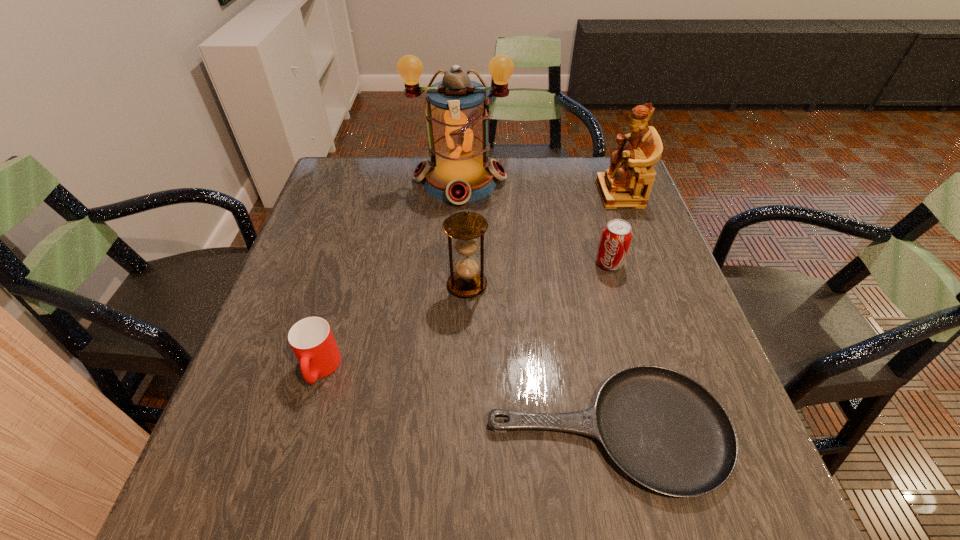
This screenshot has height=540, width=960. I want to click on free space between the hourglass and the fifth shortest object, so click(x=543, y=239).

Image resolution: width=960 pixels, height=540 pixels. I want to click on vacant space that's between the frying pan and the soda, so click(x=609, y=347).

Locate an element on the screen. Image resolution: width=960 pixels, height=540 pixels. vacant space that is in between the shortest object and the second shortest object is located at coordinates (464, 400).

This screenshot has width=960, height=540. What are the coordinates of `vacant area between the soda and the second shortest object` in the screenshot? It's located at (465, 316).

The height and width of the screenshot is (540, 960). Identify the location of unoccupied area between the third shortest object and the fourth shortest object. tap(538, 274).

Select which object is the fourth closest to the third shortest object. Please provide its 2D coordinates. Your answer should be formatted as a tuple, i.e. [(x, y)], where the tuple contains the x and y coordinates of a point satisfying the conditions above.

[(665, 430)]

This screenshot has width=960, height=540. I want to click on object that is the third closest to the soda, so click(457, 113).

Locate an element on the screen. The height and width of the screenshot is (540, 960). free location that satisfies the following two spatial constraints: 1. on the front-facing side of the fourth shortest object; 2. on the right side of the lantern is located at coordinates (454, 285).

At what (x,y) coordinates should I click in order to perform the action: click on vacant area that satisfies the following two spatial constraints: 1. on the front-facing side of the figurine; 2. on the side of the cup with the handle. Please return your answer as a coordinate pair (x, y). Looking at the image, I should click on (685, 368).

What are the coordinates of `vacant space that satisfies the following two spatial constraints: 1. on the side of the shortest object with the handle; 2. on the right side of the fifth tallest object` in the screenshot? It's located at (302, 430).